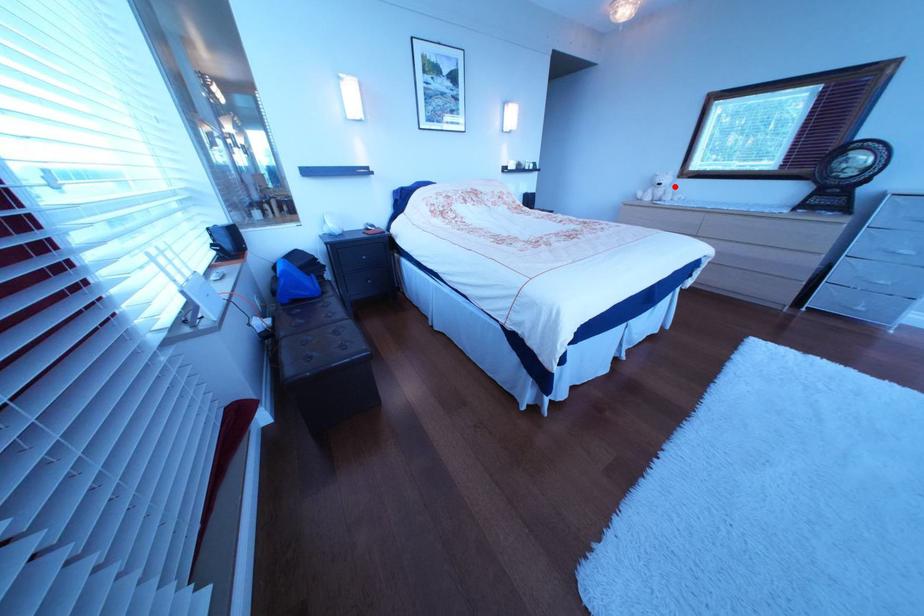
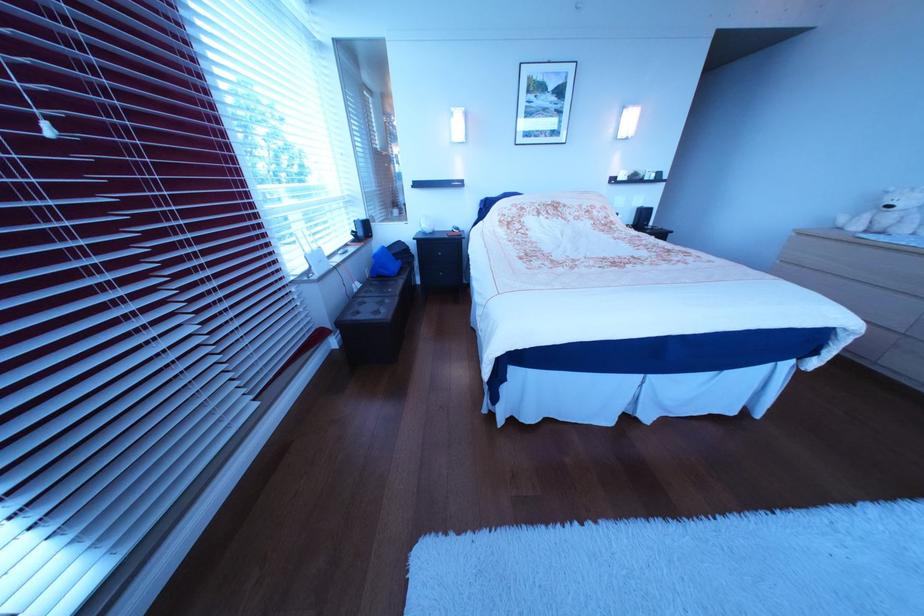
Question: I am providing you with two images of the same scene from different viewpoints. Image1 has a red point marked. In image2, the corresponding 3D location appears at what relative position? Reply with the corresponding letter.

Choices:
 (A) Closer
 (B) Farther

Answer: (B)